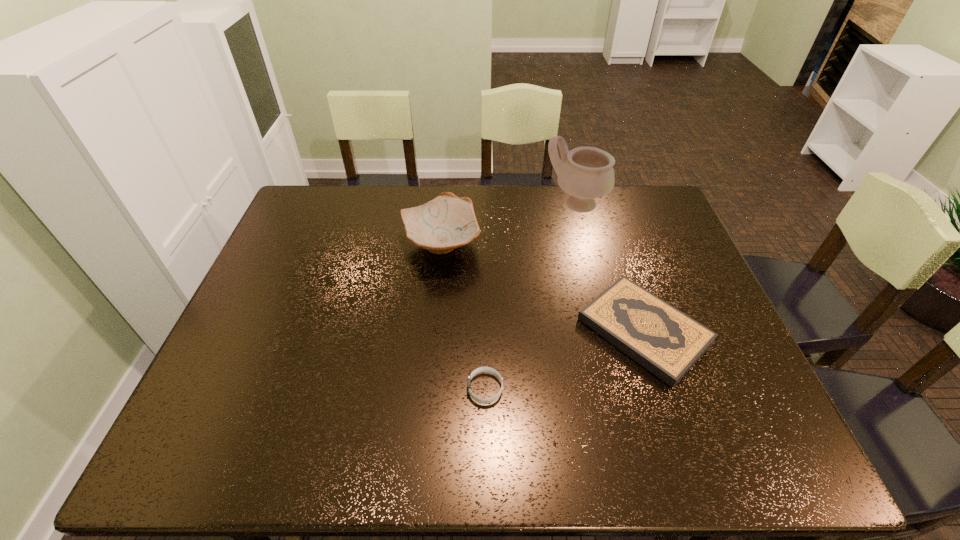
Locate an element on the screen. The image size is (960, 540). vacant region located on the outer surface of the wristband is located at coordinates (379, 388).

The width and height of the screenshot is (960, 540). In order to click on vacant space located on the outer surface of the wristband in this screenshot , I will do `click(370, 388)`.

This screenshot has width=960, height=540. I want to click on object at the right edge, so click(667, 342).

In the image, there is a desktop. What are the coordinates of `free region at the far edge` in the screenshot? It's located at pos(500,201).

The height and width of the screenshot is (540, 960). I want to click on vacant space at the near edge, so click(265, 430).

The width and height of the screenshot is (960, 540). In the image, there is a desktop. Identify the location of free space at the left edge. (230, 378).

At what (x,y) coordinates should I click in order to perform the action: click on vacant space at the right edge of the desktop. Please return your answer as a coordinate pair (x, y). Looking at the image, I should click on (636, 258).

Identify the location of free space at the far left corner of the desktop. The width and height of the screenshot is (960, 540). (326, 189).

This screenshot has width=960, height=540. In order to click on free space at the far right corner of the desktop in this screenshot , I will do `click(627, 200)`.

Where is `vacant region between the taller pottery and the wristband`? The width and height of the screenshot is (960, 540). vacant region between the taller pottery and the wristband is located at coordinates (531, 296).